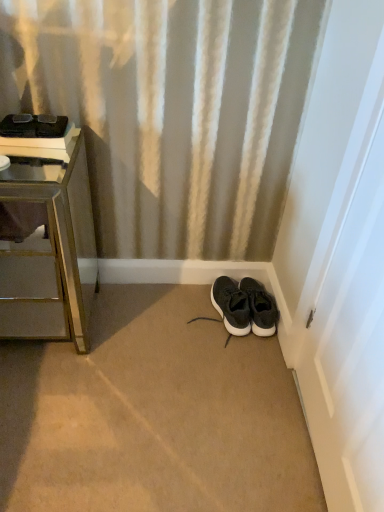
Where is `free space behind white glossy door at right`? The image size is (384, 512). free space behind white glossy door at right is located at coordinates (247, 362).